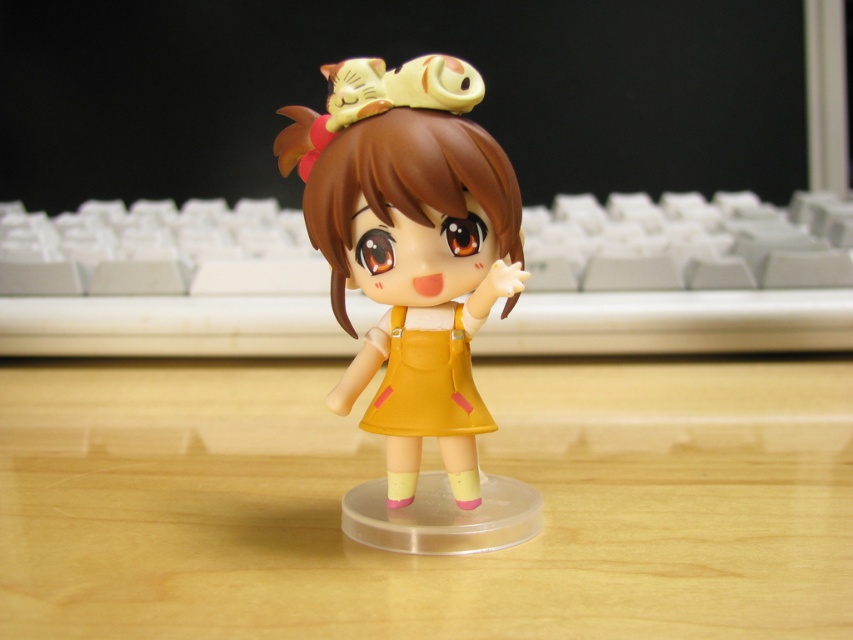
How far apart are white plastic keyboard at center and matte yellow dress at center?

25.98 inches

Is white plastic keyboard at center above matte yellow dress at center?

Yes.

Locate an element on the screen. This screenshot has height=640, width=853. white plastic keyboard at center is located at coordinates (672, 280).

Does wooden table at center have a greater width compared to yellow matte dress at center?

Yes, wooden table at center is wider than yellow matte dress at center.

Between wooden table at center and yellow matte dress at center, which one is positioned lower?

wooden table at center

Measure the distance between wooden table at center and camera.

wooden table at center is 30.19 inches away from camera.

At what (x,y) coordinates should I click in order to perform the action: click on wooden table at center. Please return your answer as a coordinate pair (x, y). This screenshot has width=853, height=640. Looking at the image, I should click on (381, 472).

Which is more to the right, white plastic keyboard at center or yellow matte dress at center?

Positioned to the right is yellow matte dress at center.

Which is above, white plastic keyboard at center or yellow matte dress at center?

white plastic keyboard at center

Which is in front, point (526, 307) or point (460, 424)?

Positioned in front is point (460, 424).

Find the location of a particular element. white plastic keyboard at center is located at coordinates (672, 280).